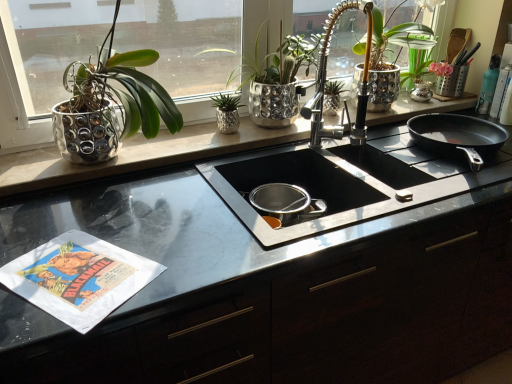
The image size is (512, 384). What are the coordinates of `free spot above black glossy countertop at center (from a real-world perspective)` in the screenshot? It's located at (333, 221).